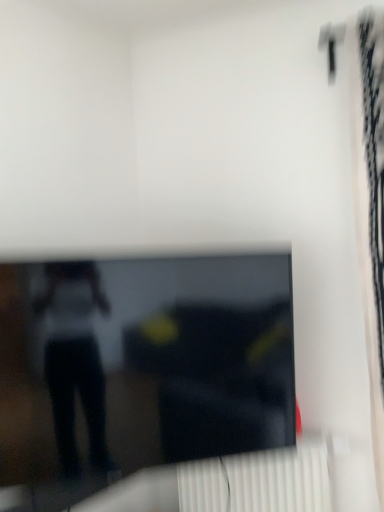
What do you see at coordinates (140, 367) in the screenshot? Image resolution: width=384 pixels, height=512 pixels. I see `black glossy television at center` at bounding box center [140, 367].

The width and height of the screenshot is (384, 512). What are the coordinates of `black glossy television at center` in the screenshot? It's located at (140, 367).

Where is `black glossy television at center`? The image size is (384, 512). black glossy television at center is located at coordinates (140, 367).